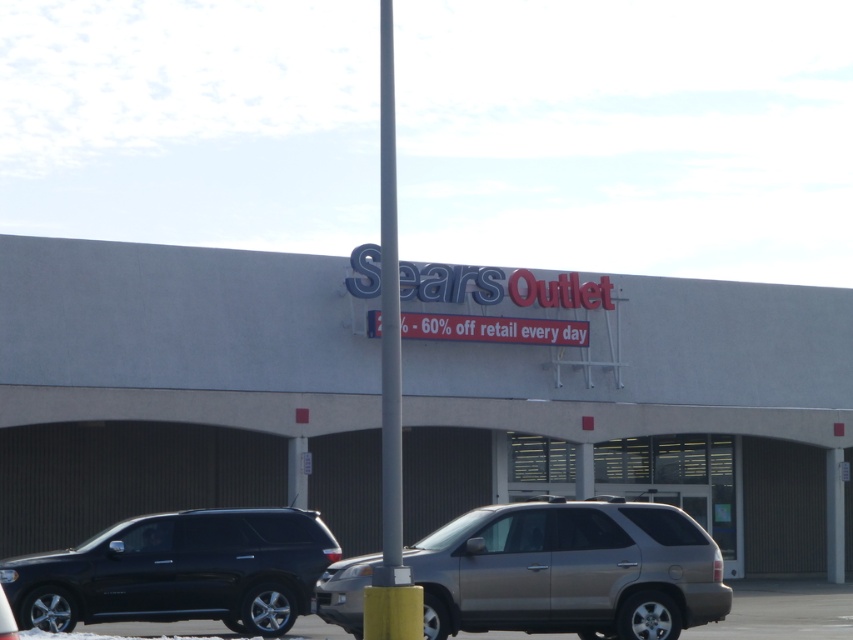
You are standing at the entrance of the Sears Outlet store and notice a metallic gray pole at center. If you were to walk directly towards the pole from the entrance, would you be walking towards the left or the right side of the pole?

Since the metallic gray pole at center is located at point coordinates that are in the center of the image, walking directly towards it from the entrance would mean you are walking straight ahead, neither to the left nor the right side of the pole.

You are a delivery driver who needs to park your truck in the parking lot of the Sears Outlet store. Your truck is 20 feet long. You see the gray concrete mall at center and the metallic gray suv at lower center. Can your truck fit between them without crossing the parking lines?

The distance between the gray concrete mall at center and the metallic gray suv at lower center is 21.60 feet. Since your truck is 20 feet long, it can fit between them as there is enough space.

You are a delivery person trying to park your van next to the shiny black suv at lower left and the metallic gray pole at center. Based on their sizes, which vehicle can you park closer to without worrying about space constraints?

The shiny black suv at lower left has a smaller size compared to the metallic gray pole at center, so you can park closer to the shiny black suv at lower left since it takes up less space.